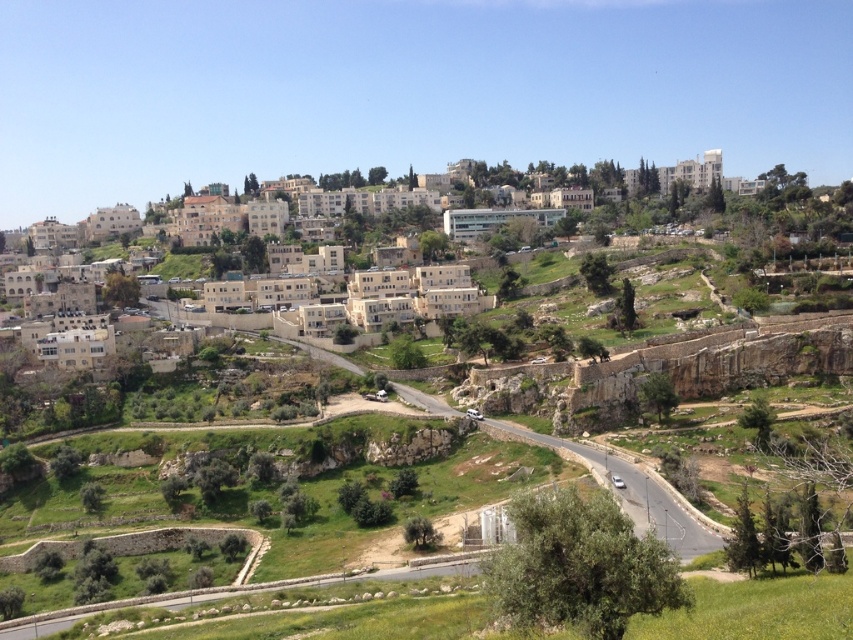
Question: Which object appears closest to the camera in this image?

Choices:
 (A) green grassy mountain path at center
 (B) beige stone buildings at upper center

Answer: (A)

Question: Is beige stone buildings at upper center positioned in front of green grassy mountain path at center?

Choices:
 (A) no
 (B) yes

Answer: (A)

Question: Which object is farther from the camera taking this photo?

Choices:
 (A) beige stone buildings at upper center
 (B) green grassy mountain path at center

Answer: (A)

Question: Does beige stone buildings at upper center appear over green grassy mountain path at center?

Choices:
 (A) yes
 (B) no

Answer: (A)

Question: Does beige stone buildings at upper center appear on the right side of green grassy mountain path at center?

Choices:
 (A) yes
 (B) no

Answer: (A)